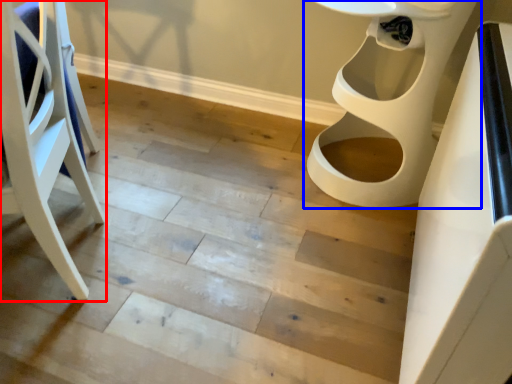
Question: Which point is closer to the camera, furniture (highlighted by a red box) or toilet (highlighted by a blue box)?

Choices:
 (A) furniture
 (B) toilet

Answer: (A)